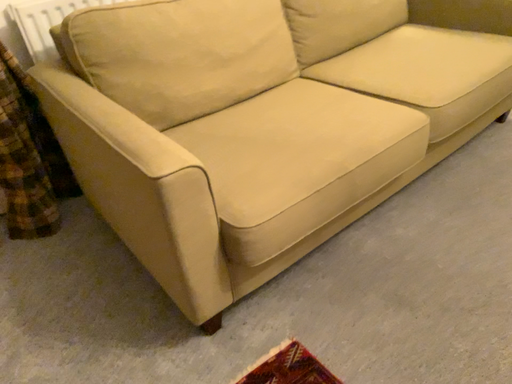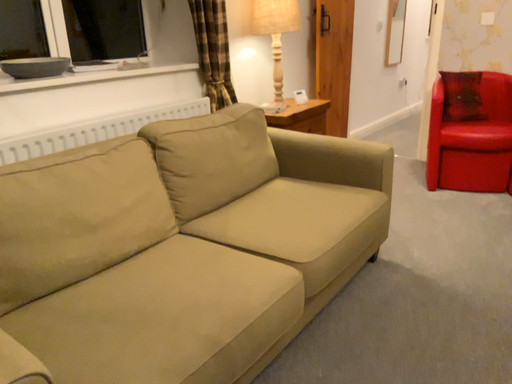
Question: How did the camera likely rotate when shooting the video?

Choices:
 (A) rotated upward
 (B) rotated downward

Answer: (A)